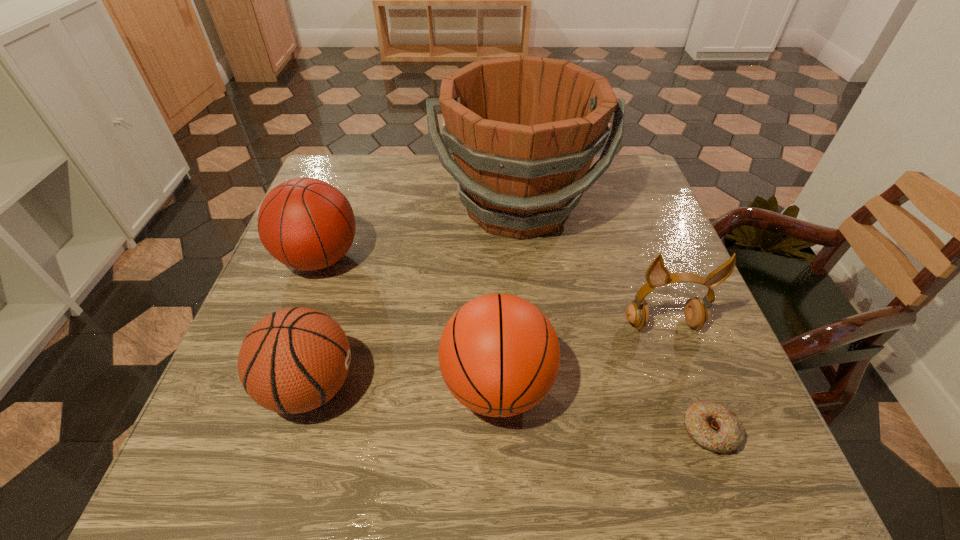
I want to click on object at the far edge, so click(x=524, y=130).

Find the location of a particular element. The width and height of the screenshot is (960, 540). basketball that is at the near edge is located at coordinates (499, 355).

Image resolution: width=960 pixels, height=540 pixels. I want to click on doughnut that is at the near edge, so click(715, 427).

Find the location of a particular element. The height and width of the screenshot is (540, 960). bucket that is at the right edge is located at coordinates (524, 130).

Where is `earphone that is at the right edge`? The height and width of the screenshot is (540, 960). earphone that is at the right edge is located at coordinates (696, 314).

Locate an element on the screen. doughnut positioned at the right edge is located at coordinates (715, 427).

What are the coordinates of `object that is at the far right corner` in the screenshot? It's located at (524, 130).

Locate an element on the screen. object present at the near right corner is located at coordinates (715, 427).

In the image, there is a desktop. Where is `vacant region at the far edge`? Image resolution: width=960 pixels, height=540 pixels. vacant region at the far edge is located at coordinates coord(398,159).

The width and height of the screenshot is (960, 540). In order to click on vacant space at the near edge of the desktop in this screenshot , I will do `click(531, 458)`.